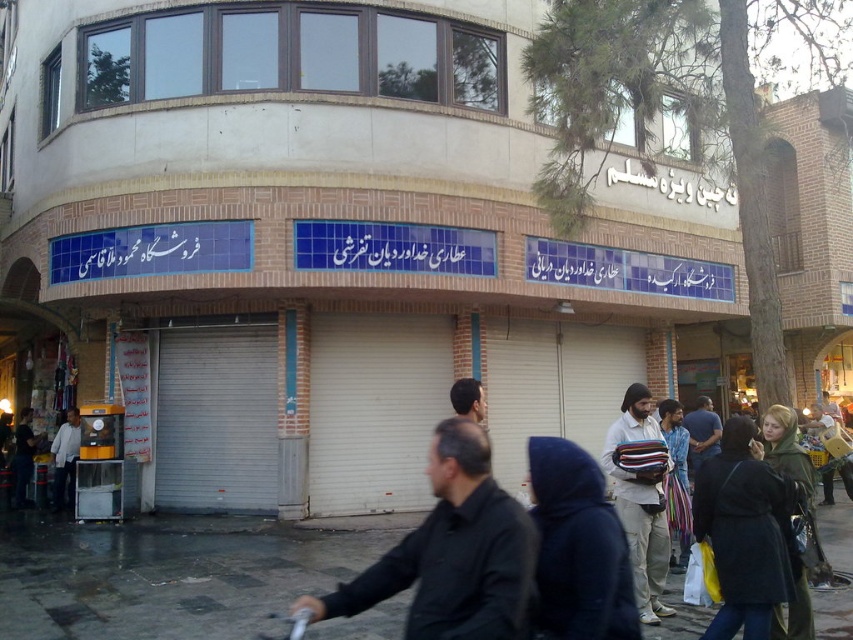
You are standing at the street corner and want to walk towards the point labeled as point [32,452]. However, there is an obstacle at point [73,433]. Will you encounter this obstacle before reaching your destination?

Yes, you will encounter the obstacle at point [73,433] before reaching point [32,452] because point [73,433] is in front of point [32,452].

You are a delivery person trying to deliver a package to the beige fabric bag at center. You have a dark blue hooded jacket at lower center blocking your path. Can you move the jacket to the right to clear the path?

The dark blue hooded jacket at lower center is positioned on the left side of the beige fabric bag at center, so moving it to the right would clear the path.

You are a delivery person standing at the street corner in front of the curved building with Arabic signs. You need to place a dark blue coat at lower right that is 4.66 meters away from you. Can you safely walk up to it without stepping into the road?

The dark blue coat at lower right is 4.66 meters away from the camera, so you can safely walk up to it without stepping into the road as it is within a reasonable distance on the sidewalk.